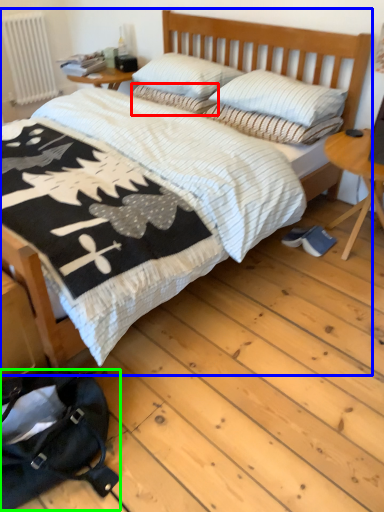
Question: Estimate the real-world distances between objects in this image. Which object is closer to pillow (highlighted by a red box), bed (highlighted by a blue box) or messenger bag (highlighted by a green box)?

Choices:
 (A) bed
 (B) messenger bag

Answer: (A)